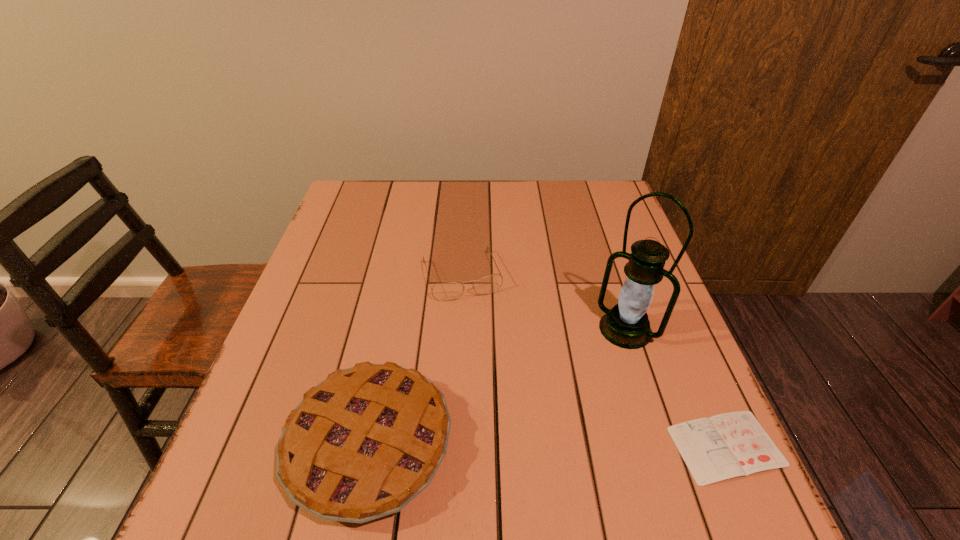
Image resolution: width=960 pixels, height=540 pixels. What are the coordinates of `free space located 0.150m on the side where the lantern emits light` in the screenshot? It's located at (575, 388).

You are a GUI agent. You are given a task and a screenshot of the screen. Output one action in this format:
    pyautogui.click(x=<x>, y=<y>)
    Task: Click on the free space located 0.300m on the front-facing side of the spectacles
    Image resolution: width=960 pixels, height=540 pixels.
    Given the screenshot: What is the action you would take?
    pyautogui.click(x=506, y=407)

In order to click on blank space located on the front-facing side of the spectacles in this screenshot , I will do `click(480, 328)`.

You are a GUI agent. You are given a task and a screenshot of the screen. Output one action in this format:
    pyautogui.click(x=<x>, y=<y>)
    Task: Click on the free point located on the front-facing side of the spectacles
    This screenshot has width=960, height=540.
    Given the screenshot: What is the action you would take?
    pyautogui.click(x=490, y=359)

The image size is (960, 540). I want to click on pie at the near edge, so click(362, 444).

At what (x,y) coordinates should I click in order to perform the action: click on diary that is at the near edge. Please return your answer as a coordinate pair (x, y). This screenshot has height=540, width=960. Looking at the image, I should click on (729, 445).

Find the location of a particular element. The image size is (960, 540). object that is positioned at the left edge is located at coordinates (362, 444).

This screenshot has width=960, height=540. Identify the location of diary located in the right edge section of the desktop. (729, 445).

In order to click on lantern situated at the right edge in this screenshot , I will do `click(626, 325)`.

Identify the location of object that is at the near left corner. click(x=362, y=444).